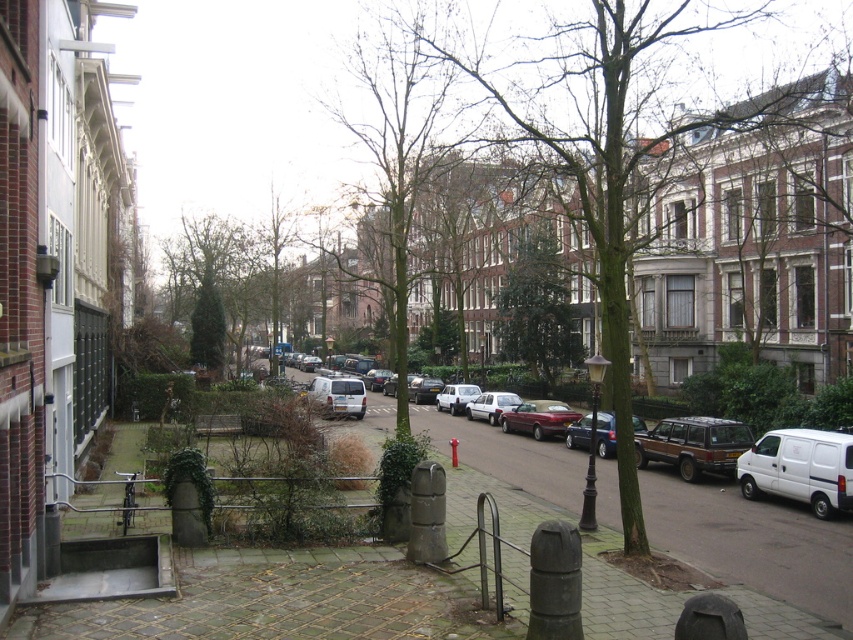
Question: Is matte blue sedan at center to the right of silver metallic sedan at center from the viewer's perspective?

Choices:
 (A) yes
 (B) no

Answer: (A)

Question: Is green glossy tree at center bigger than shiny maroon sedan at center?

Choices:
 (A) yes
 (B) no

Answer: (A)

Question: Which of the following is the closest to the observer?

Choices:
 (A) matte silver van at center
 (B) white matte van at right
 (C) shiny maroon sedan at center
 (D) matte blue sedan at center

Answer: (D)

Question: Among these points, which one is farthest from the camera?

Choices:
 (A) (612, 438)
 (B) (556, 429)
 (C) (809, 164)

Answer: (C)

Question: Can you confirm if shiny maroon sedan at center is positioned above silver metallic sedan at center?

Choices:
 (A) yes
 (B) no

Answer: (A)

Question: Estimate the real-world distances between objects in this image. Which object is closer to the brown textured tree at center?

Choices:
 (A) matte blue sedan at center
 (B) silver metallic sedan at center
 (C) rusty metallic suv at center-right
 (D) shiny maroon sedan at center

Answer: (A)